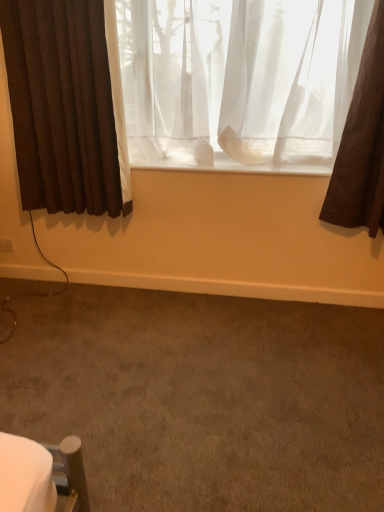
Question: From a real-world perspective, is white plastic electric outlet at lower left on top of brown fabric curtain at left, arranged as the first curtain when viewed from the left?

Choices:
 (A) yes
 (B) no

Answer: (B)

Question: Considering the relative sizes of white plastic electric outlet at lower left and brown fabric curtain at left, marked as the 2th curtain in a right-to-left arrangement, in the image provided, is white plastic electric outlet at lower left wider than brown fabric curtain at left, marked as the 2th curtain in a right-to-left arrangement,?

Choices:
 (A) no
 (B) yes

Answer: (A)

Question: Can you confirm if white plastic electric outlet at lower left is positioned to the left of brown fabric curtain at left, arranged as the first curtain when viewed from the left?

Choices:
 (A) no
 (B) yes

Answer: (B)

Question: Can you confirm if white plastic electric outlet at lower left is shorter than brown fabric curtain at left, marked as the 2th curtain in a right-to-left arrangement?

Choices:
 (A) yes
 (B) no

Answer: (A)

Question: From the image's perspective, is white plastic electric outlet at lower left on top of brown fabric curtain at left, arranged as the first curtain when viewed from the left?

Choices:
 (A) yes
 (B) no

Answer: (B)

Question: From the image's perspective, is white plastic electric outlet at lower left below brown fabric curtain at left, marked as the 2th curtain in a right-to-left arrangement?

Choices:
 (A) no
 (B) yes

Answer: (B)

Question: Is brown fabric curtain at left, arranged as the first curtain when viewed from the left, located within sheer white curtain at center, which is counted as the 1th curtain, starting from the right?

Choices:
 (A) yes
 (B) no

Answer: (B)

Question: Does sheer white curtain at center, which is counted as the 1th curtain, starting from the right, have a smaller size compared to brown fabric curtain at left, marked as the 2th curtain in a right-to-left arrangement?

Choices:
 (A) yes
 (B) no

Answer: (B)

Question: Is sheer white curtain at center, placed as the second curtain when sorted from left to right, looking in the opposite direction of brown fabric curtain at left, marked as the 2th curtain in a right-to-left arrangement?

Choices:
 (A) yes
 (B) no

Answer: (B)

Question: Is sheer white curtain at center, which is counted as the 1th curtain, starting from the right, thinner than brown fabric curtain at left, arranged as the first curtain when viewed from the left?

Choices:
 (A) yes
 (B) no

Answer: (B)

Question: Considering the relative positions of sheer white curtain at center, which is counted as the 1th curtain, starting from the right, and brown fabric curtain at left, marked as the 2th curtain in a right-to-left arrangement, in the image provided, is sheer white curtain at center, which is counted as the 1th curtain, starting from the right, to the right of brown fabric curtain at left, marked as the 2th curtain in a right-to-left arrangement, from the viewer's perspective?

Choices:
 (A) yes
 (B) no

Answer: (A)

Question: From a real-world perspective, is sheer white curtain at center, placed as the second curtain when sorted from left to right, over brown fabric curtain at left, arranged as the first curtain when viewed from the left?

Choices:
 (A) yes
 (B) no

Answer: (A)

Question: From a real-world perspective, does white plastic electric outlet at lower left stand above sheer white curtain at center, placed as the second curtain when sorted from left to right?

Choices:
 (A) no
 (B) yes

Answer: (A)